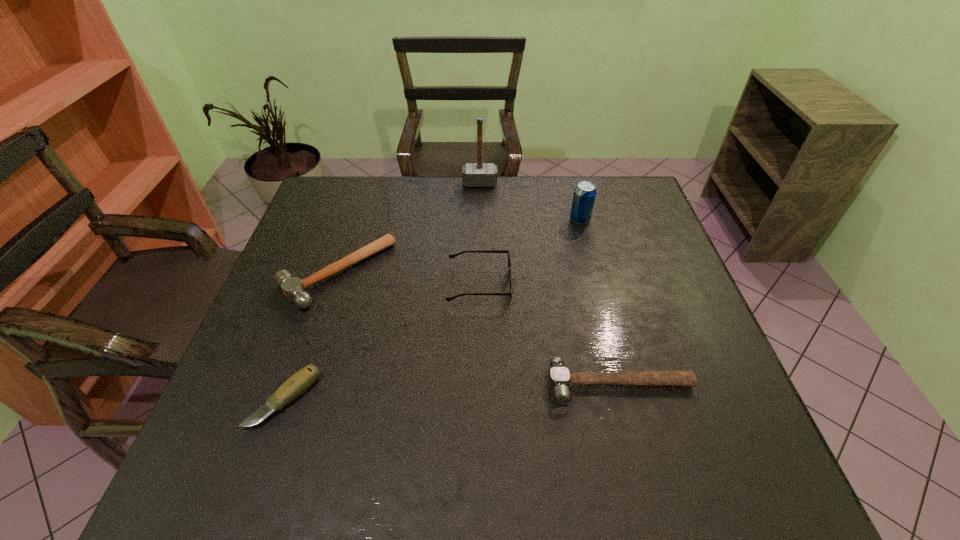
Image resolution: width=960 pixels, height=540 pixels. In order to click on vacant space at the far edge in this screenshot , I will do `click(447, 219)`.

You are a GUI agent. You are given a task and a screenshot of the screen. Output one action in this format:
    pyautogui.click(x=<x>, y=<y>)
    Task: Click on the free space at the near edge of the desktop
    This screenshot has height=540, width=960.
    Given the screenshot: What is the action you would take?
    pyautogui.click(x=384, y=480)

Locate an element on the screen. This screenshot has width=960, height=540. vacant area at the right edge is located at coordinates (612, 239).

Image resolution: width=960 pixels, height=540 pixels. I want to click on vacant region at the far left corner of the desktop, so click(352, 212).

The image size is (960, 540). I want to click on free location at the near left corner, so click(x=212, y=467).

Locate an element on the screen. The width and height of the screenshot is (960, 540). vacant region at the far right corner of the desktop is located at coordinates (606, 186).

This screenshot has height=540, width=960. I want to click on free space between the farthest object and the rightmost hammer, so click(x=550, y=284).

Where is `free space between the second farthest hammer and the tallest hammer`? This screenshot has width=960, height=540. free space between the second farthest hammer and the tallest hammer is located at coordinates (408, 228).

This screenshot has height=540, width=960. Find the location of `vacant area that lies between the second farthest hammer and the shortest hammer`. vacant area that lies between the second farthest hammer and the shortest hammer is located at coordinates (478, 328).

Locate an element on the screen. The image size is (960, 540). unoccupied position between the shortest object and the sunglasses is located at coordinates (382, 342).